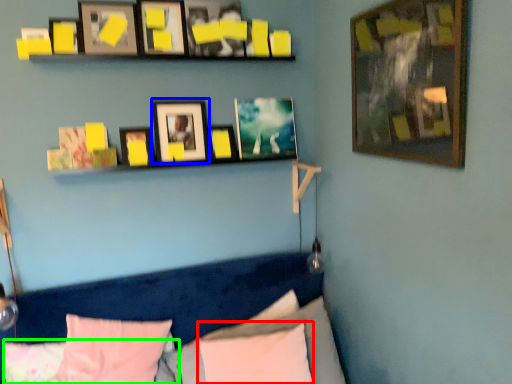
Question: Which object is the closest to the pillow (highlighted by a red box)? Choose among these: picture frame (highlighted by a blue box) or pillow (highlighted by a green box).

Choices:
 (A) picture frame
 (B) pillow

Answer: (B)